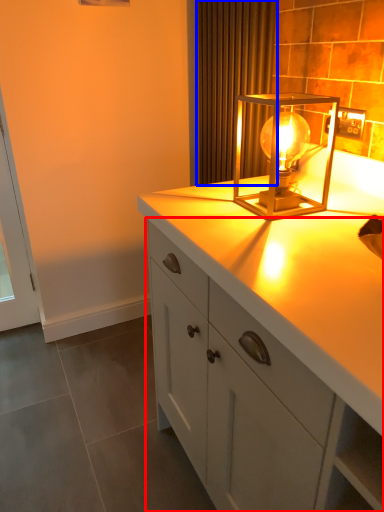
Question: Which object appears farthest to the camera in this image, cabinetry (highlighted by a red box) or curtain (highlighted by a blue box)?

Choices:
 (A) cabinetry
 (B) curtain

Answer: (B)